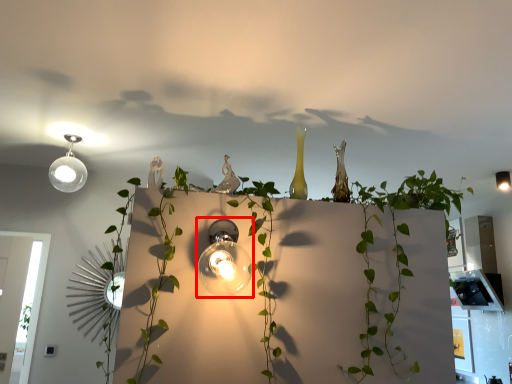
Question: From the image's perspective, considering the relative positions of lamp (annotated by the red box) and lamp in the image provided, where is lamp (annotated by the red box) located with respect to the staircase?

Choices:
 (A) below
 (B) above

Answer: (A)